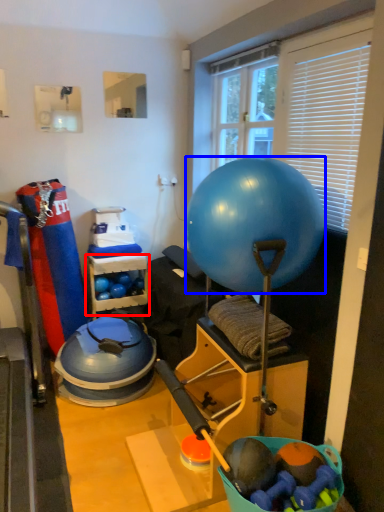
Question: Which object is closer to the camera taking this photo, shelf (highlighted by a red box) or ball (highlighted by a blue box)?

Choices:
 (A) shelf
 (B) ball

Answer: (B)